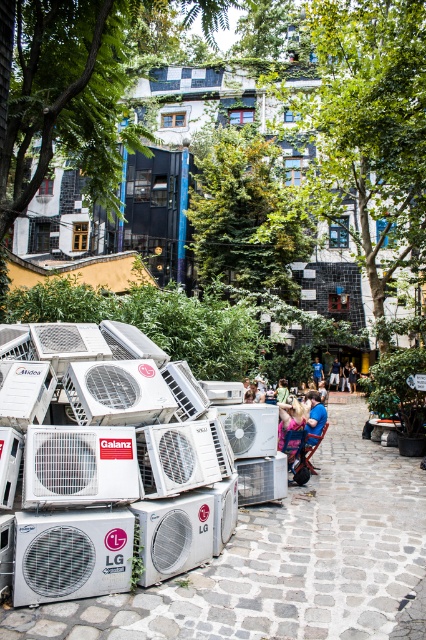
Question: Which point is closer to the camera taking this photo?

Choices:
 (A) (118, 552)
 (B) (173, 520)
 (C) (374, 182)

Answer: (A)

Question: Estimate the real-world distances between objects in this image. Which object is closer to the green leafy tree at center?

Choices:
 (A) green leafy tree at upper center
 (B) blue fabric dress at center

Answer: (A)

Question: Is green leafy tree at center in front of silver metallic air conditioner at center?

Choices:
 (A) yes
 (B) no

Answer: (B)

Question: Which of these objects is positioned farthest from the silver metallic lg air conditioner at lower left?

Choices:
 (A) green leafy tree at center
 (B) green leafy tree at upper center
 (C) light brown wooden chair at center

Answer: (C)

Question: Does blue fabric dress at center have a larger size compared to light brown leather jacket at center?

Choices:
 (A) no
 (B) yes

Answer: (A)

Question: Can you confirm if silver metallic air conditioner at center is positioned above dark blue shirt at center?

Choices:
 (A) yes
 (B) no

Answer: (A)